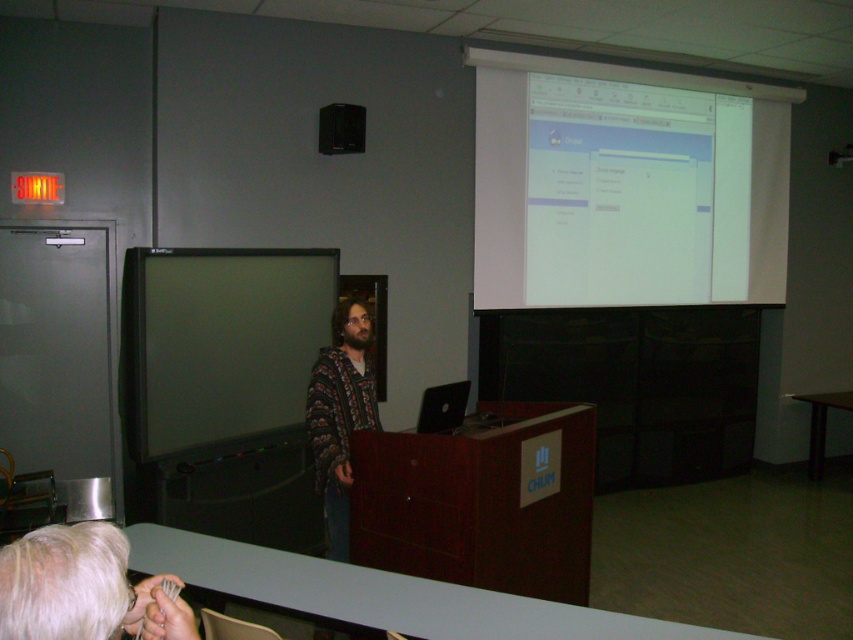
You are standing in the classroom and see two points on the screen. The first point is at coordinate point(126, 332) and the second is at point(354, 150). Which point is closer to you?

Point(126, 332) is in front of point(354, 150), so it is closer to you.

Consider the image. You are standing in the classroom and want to take a photo of the point at coordinates (186, 362). The camera you have can focus on objects within 4 meters. Will the point be in focus?

The point at coordinates (186, 362) is 3.57 meters away from the camera, which is within the 4 meters focusing range. Therefore, the point will be in focus.

You are sitting in the front row of the classroom and want to look at both the white glossy projector screen at upper right and the matte black monitor at center. Which one will you need to look up to see first?

The white glossy projector screen at upper right is further to the viewer than the matte black monitor at center, so you will need to look up to see the white glossy projector screen at upper right first before looking down to view the matte black monitor at center.